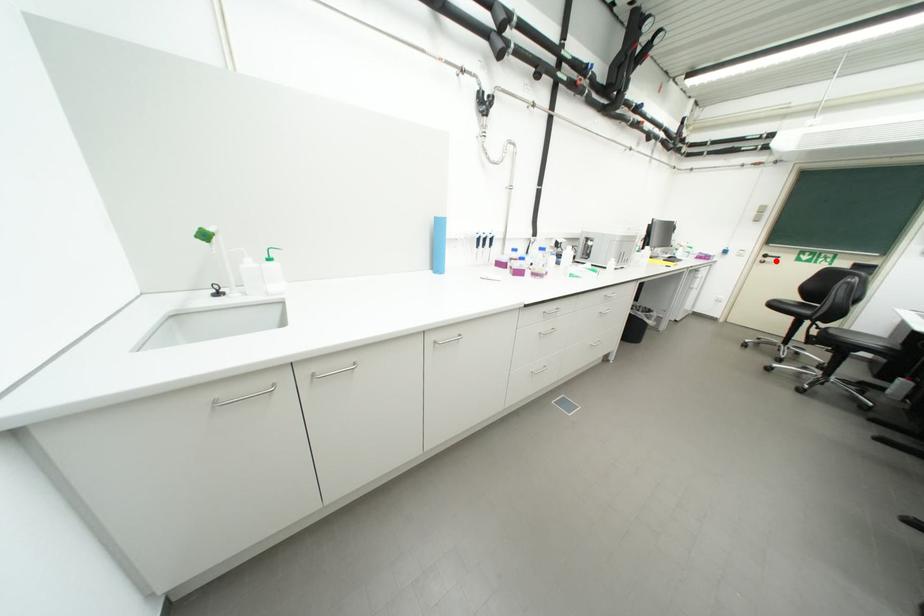
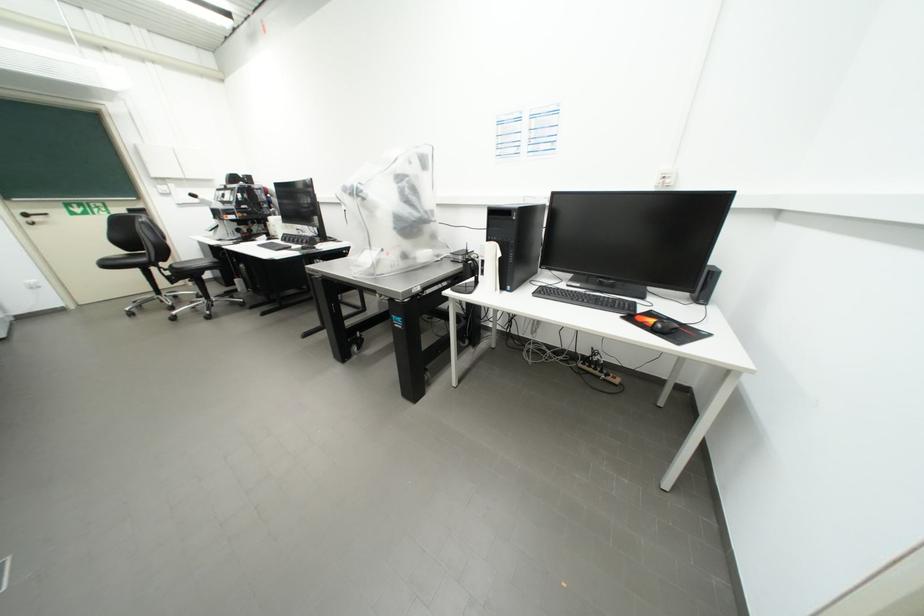
Question: I am providing you with two images of the same scene from different viewpoints. A red point is marked on the first image. At the location where the point appears in image 1, is it still visible in image 2?

Choices:
 (A) Yes
 (B) No

Answer: (A)